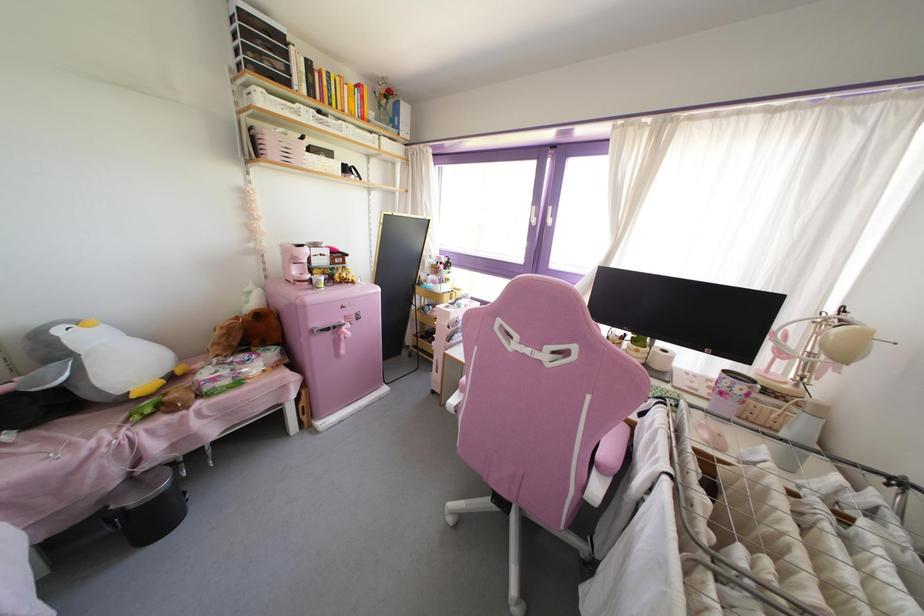
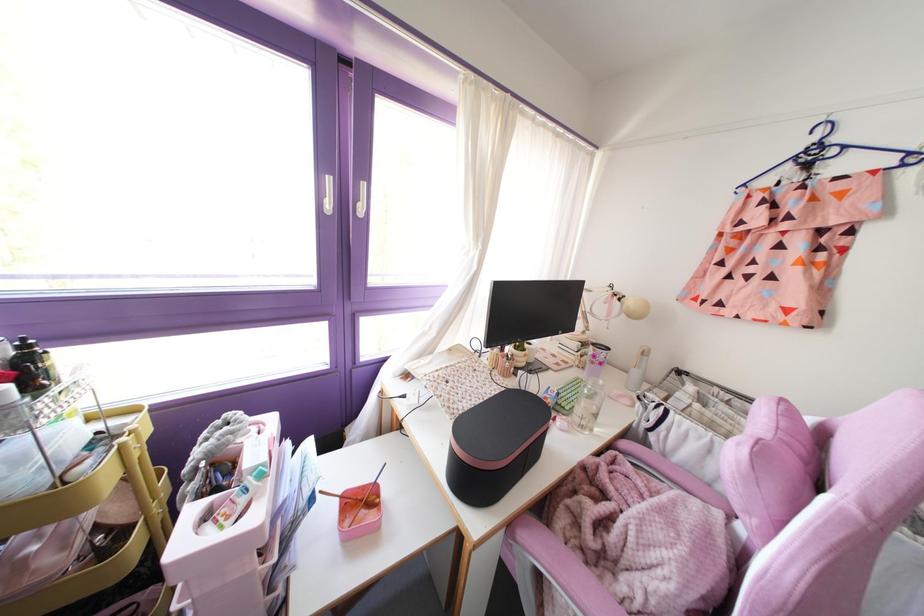
Where in the second image is the point corresponding to (x=457, y=305) from the first image?

(261, 475)